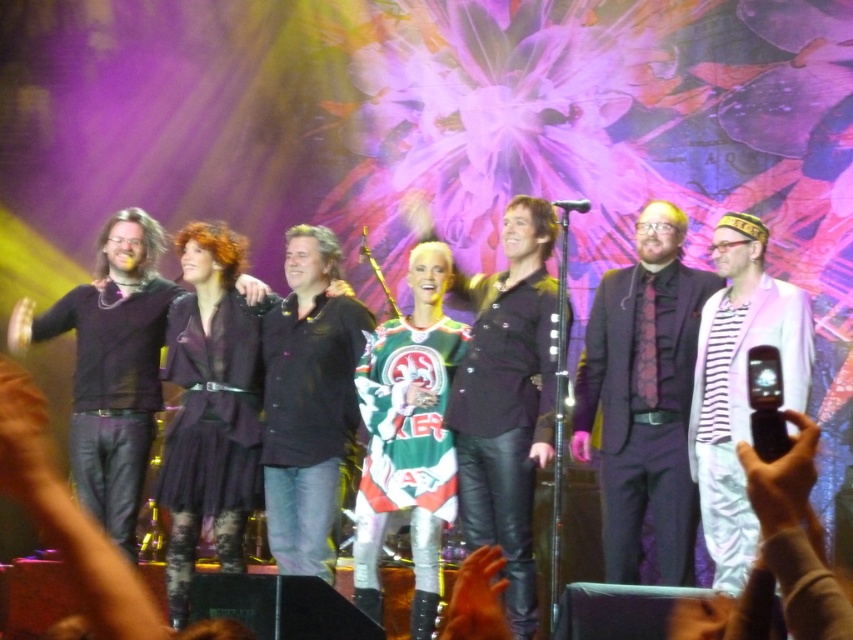
Is dark purple suit at center smaller than matte black jacket at center?

No.

Does dark purple suit at center have a lesser width compared to matte black jacket at center?

No.

Where is `dark purple suit at center`? The image size is (853, 640). dark purple suit at center is located at coordinates (643, 397).

This screenshot has height=640, width=853. What are the coordinates of `dark purple suit at center` in the screenshot? It's located at (643, 397).

Who is positioned more to the right, white striped shirt at right or matte black jacket at center?

white striped shirt at right

Between white striped shirt at right and matte black jacket at center, which one has less height?

Standing shorter between the two is matte black jacket at center.

The width and height of the screenshot is (853, 640). I want to click on white striped shirt at right, so click(740, 385).

Locate an element on the screen. white striped shirt at right is located at coordinates [x=740, y=385].

Between dark purple suit at center and white striped shirt at right, which one is positioned higher?

dark purple suit at center is higher up.

Is dark purple suit at center to the left of white striped shirt at right from the viewer's perspective?

Yes, dark purple suit at center is to the left of white striped shirt at right.

Which is behind, point (692, 324) or point (740, 221)?

The point (692, 324) is behind.

Locate an element on the screen. The image size is (853, 640). dark purple suit at center is located at coordinates (643, 397).